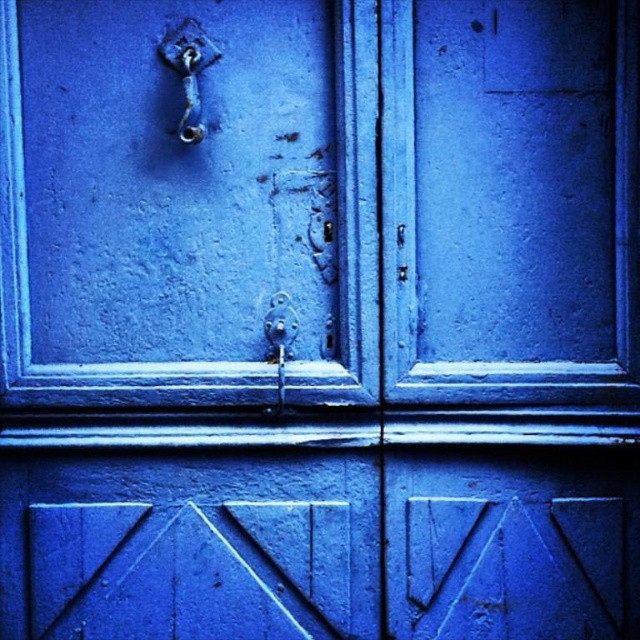
Question: Is matte blue door handle at upper left behind polished brass hook at upper left?

Choices:
 (A) no
 (B) yes

Answer: (B)

Question: Among these points, which one is farthest from the camera?

Choices:
 (A) (182, 116)
 (B) (328, 161)

Answer: (B)

Question: Does matte blue door handle at upper left have a smaller size compared to polished brass hook at upper left?

Choices:
 (A) no
 (B) yes

Answer: (A)

Question: Does matte blue door handle at upper left appear under polished brass hook at upper left?

Choices:
 (A) yes
 (B) no

Answer: (A)

Question: Which point is closer to the camera taking this photo?

Choices:
 (A) (170, 42)
 (B) (323, 321)

Answer: (A)

Question: Which object appears farthest from the camera in this image?

Choices:
 (A) polished brass hook at upper left
 (B) matte blue door handle at upper left

Answer: (B)